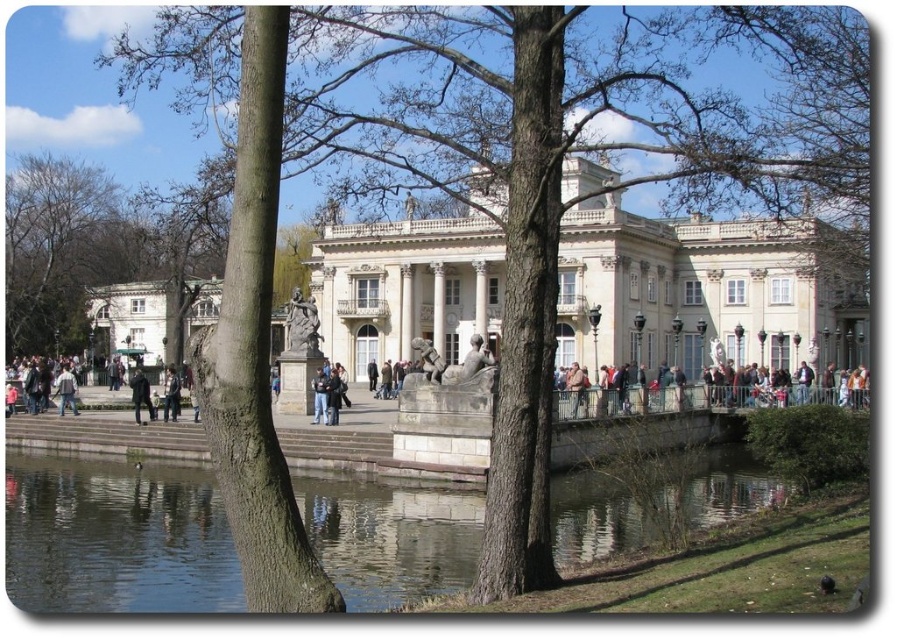
Who is higher up, bare wood tree at upper left or white stone palace at left?

bare wood tree at upper left

Does bare wood tree at upper left appear on the right side of white stone palace at left?

No, bare wood tree at upper left is not to the right of white stone palace at left.

The width and height of the screenshot is (897, 640). Identify the location of bare wood tree at upper left. (53, 250).

Who is positioned more to the right, white marble palace at center or dark blue jeans at center?

From the viewer's perspective, white marble palace at center appears more on the right side.

Is white marble palace at center bigger than dark blue jeans at center?

Yes.

Where is `white marble palace at center`? The height and width of the screenshot is (640, 897). white marble palace at center is located at coordinates (704, 292).

Can you confirm if clear water at pond center is positioned to the right of dark blue jacket at center?

Yes, clear water at pond center is to the right of dark blue jacket at center.

Does clear water at pond center appear over dark blue jacket at center?

Actually, clear water at pond center is below dark blue jacket at center.

Is point (315, 502) closer to viewer compared to point (131, 388)?

Yes.

This screenshot has height=640, width=897. Find the location of `clear water at pond center`. clear water at pond center is located at coordinates [x=115, y=538].